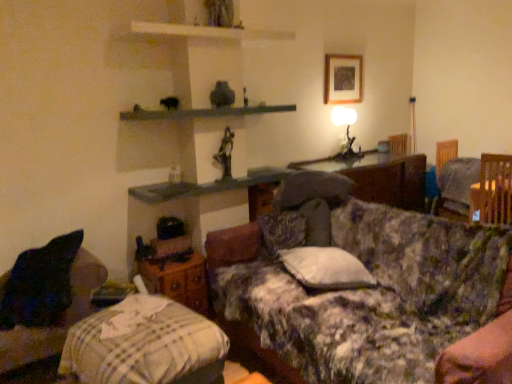
This screenshot has width=512, height=384. What are the coordinates of `empty space that is ontop of wooden at left (from a real-world perspective)` in the screenshot? It's located at (176, 260).